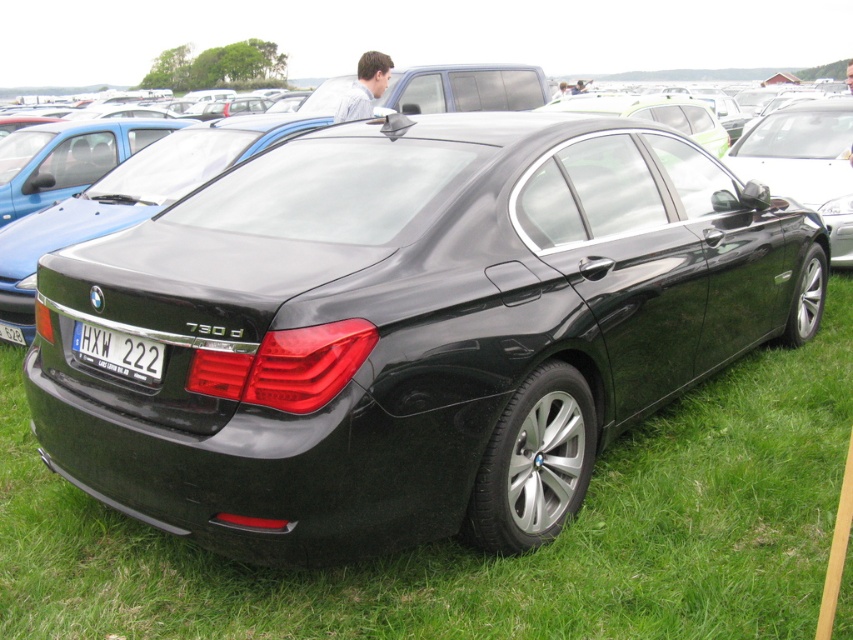
Based on the photo, between white plastic license plate at center and white plastic license plate at rear, which one is positioned higher?

Positioned higher is white plastic license plate at rear.

Between white plastic license plate at center and white plastic license plate at rear, which one has more height?

white plastic license plate at center is taller.

Between point (135, 355) and point (15, 330), which one is positioned behind?

The point (15, 330) is more distant.

The width and height of the screenshot is (853, 640). Find the location of `white plastic license plate at center`. white plastic license plate at center is located at coordinates (119, 353).

Which is behind, point (694, 538) or point (103, 336)?

Point (694, 538)

Which is more to the right, green grass at lower center or white plastic license plate at center?

green grass at lower center is more to the right.

Find the location of a particular element. This screenshot has width=853, height=640. green grass at lower center is located at coordinates (480, 552).

Is green grass at lower center above white plastic license plate at rear?

Actually, green grass at lower center is below white plastic license plate at rear.

Where is `green grass at lower center`? green grass at lower center is located at coordinates (480, 552).